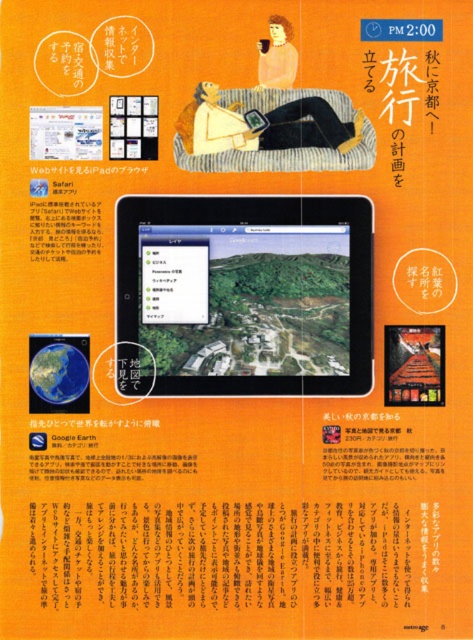
You are standing in front of a large advertisement for an iPad. The advertisement has a point at coordinate (315, 364). If you want to touch this point on the advertisement with a stick that is 1.2 meters long, will the stick be long enough?

The point at coordinate (315, 364) is 1.30 meters away from the viewer. Since the stick is only 1.2 meters long, it is not long enough to reach the point.

Consider the image. You are looking at the iPad map in the advertisement. There are two points marked on the map. Which point is closer to you, point at coordinates (183, 545) or point at coordinates (313, 108)?

Point at coordinates (183, 545) is in front of point at coordinates (313, 108), so it is closer to you.

You are designing a poster and need to place two elements at the upper center area. The orange paper at upper center and the pastel yellow hair at upper center. Which one should you make wider to maintain visual balance?

The orange paper at upper center should be made wider since its width is already larger than the pastel yellow hair at upper center, maintaining visual balance by emphasizing its dominance.